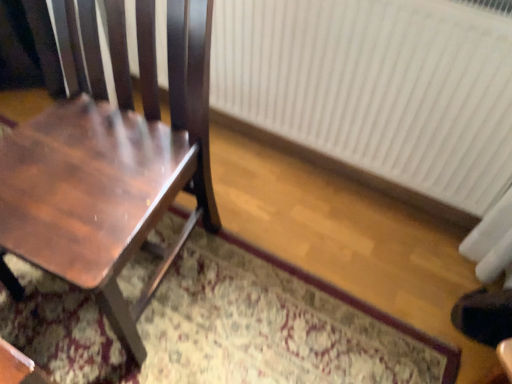
Question: Does point (381, 347) appear closer or farther from the camera than point (435, 82)?

Choices:
 (A) closer
 (B) farther

Answer: (B)

Question: Considering the positions of patterned carpet at center and white plastic radiator at right in the image, is patterned carpet at center bigger or smaller than white plastic radiator at right?

Choices:
 (A) small
 (B) big

Answer: (B)

Question: Which object is the closest to the shiny brown wood chair at left?

Choices:
 (A) patterned carpet at center
 (B) white plastic radiator at right

Answer: (A)

Question: Based on their relative distances, which object is farther from the shiny brown wood chair at left?

Choices:
 (A) white plastic radiator at right
 (B) patterned carpet at center

Answer: (A)